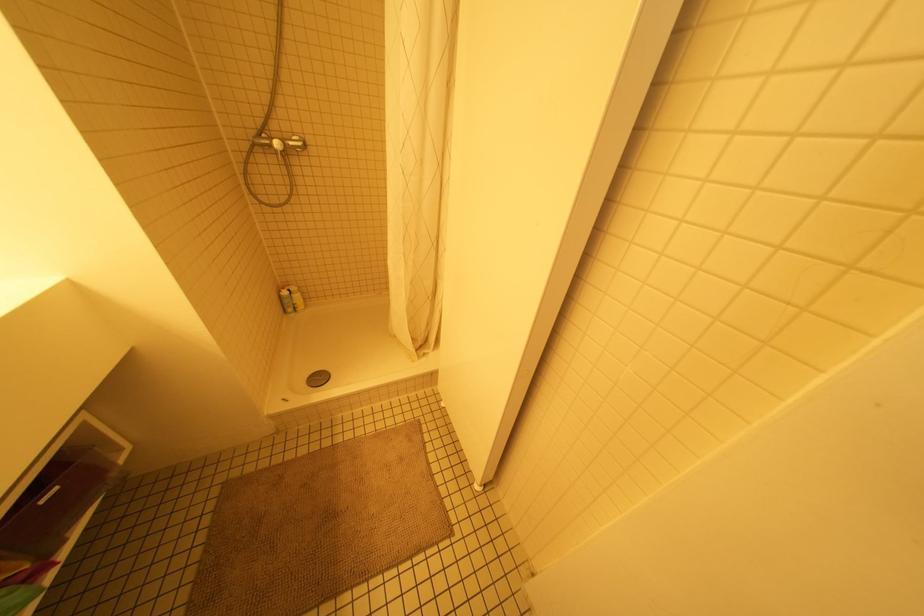
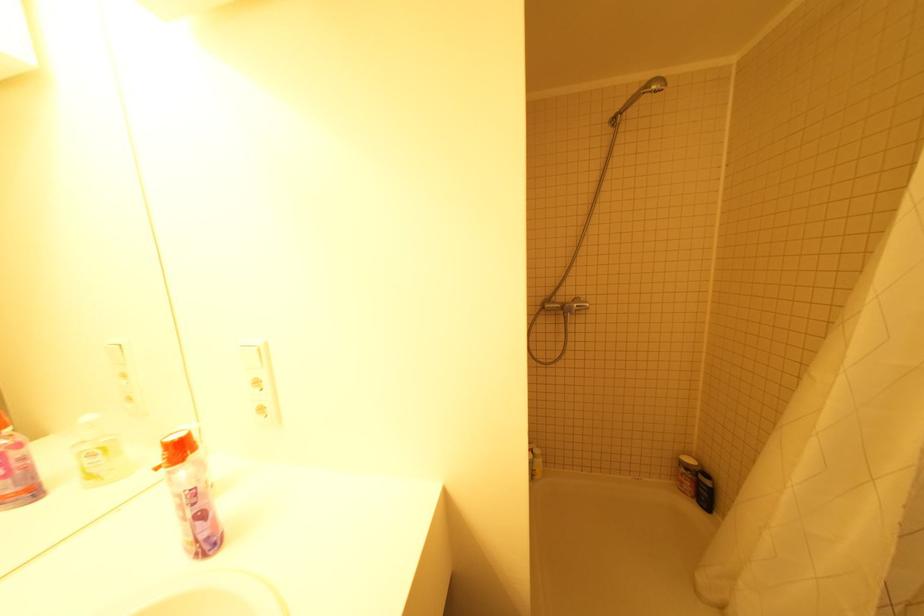
The point at [262,146] is marked in the first image. Where is the corresponding point in the second image?

(550, 310)